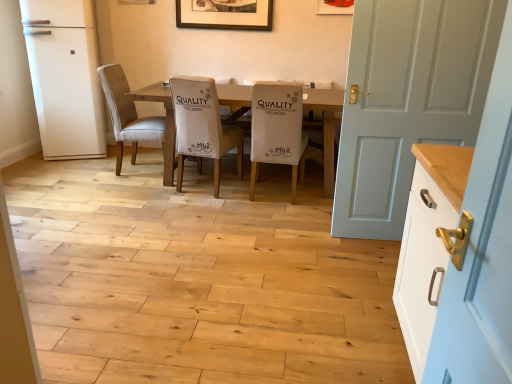
Question: Is wooden picture frame at upper center, positioned as the first picture frame in left-to-right order, aimed at white fabric chair at center, which appears as the second chair when viewed from the right?

Choices:
 (A) no
 (B) yes

Answer: (A)

Question: Is wooden picture frame at upper center, which appears as the first picture frame when viewed from the back, shorter than white fabric chair at center, which appears as the second chair when viewed from the right?

Choices:
 (A) yes
 (B) no

Answer: (A)

Question: Is white fabric chair at center, which appears as the second chair when viewed from the right, at the back of wooden picture frame at upper center, the 2th picture frame from the front?

Choices:
 (A) yes
 (B) no

Answer: (B)

Question: Is wooden picture frame at upper center, which ranks as the 2th picture frame in right-to-left order, in front of white fabric chair at center, which appears as the second chair when viewed from the right?

Choices:
 (A) yes
 (B) no

Answer: (B)

Question: From a real-world perspective, is wooden picture frame at upper center, the 2th picture frame from the front, on top of white fabric chair at center, which is the 2th chair from left to right?

Choices:
 (A) no
 (B) yes

Answer: (B)

Question: From a real-world perspective, is matte white picture frame at upper center, marked as the 2th picture frame in a back-to-front arrangement, above or below white matte refrigerator at left?

Choices:
 (A) above
 (B) below

Answer: (A)

Question: In the image, is matte white picture frame at upper center, which is the first picture frame in right-to-left order, positioned in front of or behind white matte refrigerator at left?

Choices:
 (A) front
 (B) behind

Answer: (B)

Question: In terms of size, does matte white picture frame at upper center, arranged as the second picture frame when viewed from the left, appear bigger or smaller than white matte refrigerator at left?

Choices:
 (A) big
 (B) small

Answer: (B)

Question: From the image's perspective, relative to white matte refrigerator at left, is matte white picture frame at upper center, the first picture frame when ordered from front to back, above or below?

Choices:
 (A) below
 (B) above

Answer: (B)

Question: From the image's perspective, relative to white painted wood door at right, is wooden picture frame at upper center, positioned as the first picture frame in left-to-right order, above or below?

Choices:
 (A) below
 (B) above

Answer: (B)

Question: Do you think wooden picture frame at upper center, which appears as the first picture frame when viewed from the back, is within white painted wood door at right, or outside of it?

Choices:
 (A) inside
 (B) outside

Answer: (B)

Question: Considering the positions of wooden picture frame at upper center, positioned as the first picture frame in left-to-right order, and white painted wood door at right in the image, is wooden picture frame at upper center, positioned as the first picture frame in left-to-right order, taller or shorter than white painted wood door at right?

Choices:
 (A) short
 (B) tall

Answer: (A)

Question: Is wooden picture frame at upper center, the 2th picture frame from the front, in front of or behind white painted wood door at right in the image?

Choices:
 (A) front
 (B) behind

Answer: (B)

Question: From the image's perspective, is white painted wood door at right located above or below wooden picture frame at upper center, which ranks as the 2th picture frame in right-to-left order?

Choices:
 (A) below
 (B) above

Answer: (A)

Question: Does point (448, 31) appear closer or farther from the camera than point (267, 21)?

Choices:
 (A) farther
 (B) closer

Answer: (B)